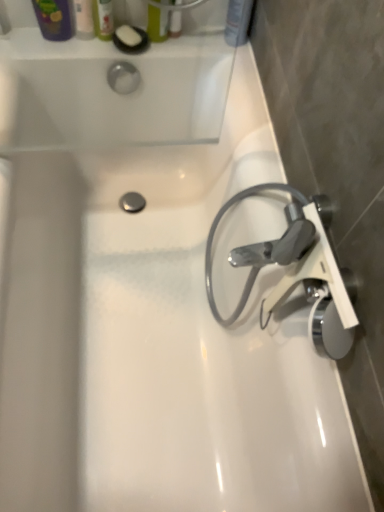
Measure the distance between white matte soap at upper left and camera.

white matte soap at upper left is 1.14 meters from camera.

This screenshot has width=384, height=512. What are the coordinates of `translucent plastic mouthwash at upper center` in the screenshot? It's located at (175, 20).

Locate an element on the screen. The width and height of the screenshot is (384, 512). translucent plastic soap at upper left, acting as the 3th toiletry starting from the right is located at coordinates (103, 19).

Where is `white matte soap at upper left`? white matte soap at upper left is located at coordinates (128, 35).

Is translucent plastic soap at upper left, acting as the 3th toiletry starting from the right, to the right of matte plastic soap at upper left, which is the 1th toiletry from left to right, from the viewer's perspective?

Indeed, translucent plastic soap at upper left, acting as the 3th toiletry starting from the right, is positioned on the right side of matte plastic soap at upper left, which is the 1th toiletry from left to right.

How distant is translucent plastic soap at upper left, positioned as the 2th toiletry in left-to-right order, from matte plastic soap at upper left, arranged as the fourth toiletry when viewed from the right?

translucent plastic soap at upper left, positioned as the 2th toiletry in left-to-right order, is 1.38 inches from matte plastic soap at upper left, arranged as the fourth toiletry when viewed from the right.

Is translucent plastic soap at upper left, positioned as the 2th toiletry in left-to-right order, further to camera compared to matte plastic soap at upper left, arranged as the fourth toiletry when viewed from the right?

No, it is not.

How different are the orientations of translucent plastic soap at upper left, positioned as the 2th toiletry in left-to-right order, and matte plastic soap at upper left, which is the 1th toiletry from left to right, in degrees?

There is a 0.00112-degree angle between the facing directions of translucent plastic soap at upper left, positioned as the 2th toiletry in left-to-right order, and matte plastic soap at upper left, which is the 1th toiletry from left to right.

In the image, is matte plastic soap at upper left, arranged as the fourth toiletry when viewed from the right, on the left side or the right side of matte green bottle at upper center, which is the 3th toiletry in left-to-right order?

From the image, it's evident that matte plastic soap at upper left, arranged as the fourth toiletry when viewed from the right, is to the left of matte green bottle at upper center, which is the 3th toiletry in left-to-right order.

Considering the sizes of objects matte plastic soap at upper left, arranged as the fourth toiletry when viewed from the right, and matte green bottle at upper center, which is the 3th toiletry in left-to-right order, in the image provided, who is shorter, matte plastic soap at upper left, arranged as the fourth toiletry when viewed from the right, or matte green bottle at upper center, which is the 3th toiletry in left-to-right order,?

With less height is matte plastic soap at upper left, arranged as the fourth toiletry when viewed from the right.

At what (x,y) coordinates should I click in order to perform the action: click on the 2nd toiletry behind the matte green bottle at upper center, the second toiletry in the right-to-left sequence, counting from the anchor's position. Please return your answer as a coordinate pair (x, y). This screenshot has height=512, width=384. Looking at the image, I should click on (84, 19).

Considering the relative positions of matte plastic soap at upper left, which is the 1th toiletry from left to right, and matte green bottle at upper center, the second toiletry in the right-to-left sequence, in the image provided, is matte plastic soap at upper left, which is the 1th toiletry from left to right, in front of matte green bottle at upper center, the second toiletry in the right-to-left sequence,?

No, matte plastic soap at upper left, which is the 1th toiletry from left to right, is further to the viewer.

Can you confirm if white matte soap at upper left is shorter than translucent plastic soap at upper left, positioned as the 2th toiletry in left-to-right order?

Yes.

Based on the photo, considering the relative sizes of white matte soap at upper left and translucent plastic soap at upper left, positioned as the 2th toiletry in left-to-right order, in the image provided, is white matte soap at upper left wider than translucent plastic soap at upper left, positioned as the 2th toiletry in left-to-right order,?

Yes, white matte soap at upper left is wider than translucent plastic soap at upper left, positioned as the 2th toiletry in left-to-right order.

From the image's perspective, which is above, white matte soap at upper left or translucent plastic soap at upper left, positioned as the 2th toiletry in left-to-right order?

translucent plastic soap at upper left, positioned as the 2th toiletry in left-to-right order.

From the image's perspective, between white matte soap at upper left and translucent plastic mouthwash at upper center, which one is located above?

translucent plastic mouthwash at upper center, from the image's perspective.

How far apart are white matte soap at upper left and translucent plastic mouthwash at upper center?

They are 4.38 inches apart.

Is point (123, 28) positioned after point (179, 33)?

No, it is not.

Considering their positions, is matte green bottle at upper center, which is the 3th toiletry in left-to-right order, located in front of or behind satin chrome faucet at right?

Clearly, matte green bottle at upper center, which is the 3th toiletry in left-to-right order, is behind satin chrome faucet at right.

From a real-world perspective, is matte green bottle at upper center, the second toiletry in the right-to-left sequence, positioned over satin chrome faucet at right based on gravity?

Yes, from a real-world perspective, matte green bottle at upper center, the second toiletry in the right-to-left sequence, is on top of satin chrome faucet at right.

Considering the positions of objects matte green bottle at upper center, the second toiletry in the right-to-left sequence, and satin chrome faucet at right in the image provided, who is more to the left, matte green bottle at upper center, the second toiletry in the right-to-left sequence, or satin chrome faucet at right?

Positioned to the left is matte green bottle at upper center, the second toiletry in the right-to-left sequence.

Is matte green bottle at upper center, the second toiletry in the right-to-left sequence, bigger than satin chrome faucet at right?

No.

Considering the positions of objects satin chrome faucet at right and translucent plastic soap at upper left, positioned as the 2th toiletry in left-to-right order, in the image provided, who is more to the left, satin chrome faucet at right or translucent plastic soap at upper left, positioned as the 2th toiletry in left-to-right order,?

Positioned to the left is translucent plastic soap at upper left, positioned as the 2th toiletry in left-to-right order.

From the image's perspective, is satin chrome faucet at right beneath translucent plastic soap at upper left, positioned as the 2th toiletry in left-to-right order?

Yes, from the image's perspective, satin chrome faucet at right is beneath translucent plastic soap at upper left, positioned as the 2th toiletry in left-to-right order.

Locate an element on the screen. This screenshot has height=512, width=384. tap located above the translucent plastic soap at upper left, acting as the 3th toiletry starting from the right (from a real-world perspective) is located at coordinates (296, 270).

Who is smaller, matte green bottle at upper center, the second toiletry in the right-to-left sequence, or white matte soap at upper left?

white matte soap at upper left.

Looking at this image, from a real-world perspective, is matte green bottle at upper center, the second toiletry in the right-to-left sequence, over white matte soap at upper left?

Yes, from a real-world perspective, matte green bottle at upper center, the second toiletry in the right-to-left sequence, is on top of white matte soap at upper left.

Is matte green bottle at upper center, which is the 3th toiletry in left-to-right order, to the right of white matte soap at upper left from the viewer's perspective?

Yes.

The image size is (384, 512). Find the location of `toiletry below the translucent plastic soap at upper left, acting as the 3th toiletry starting from the right (from a real-world perspective)`. toiletry below the translucent plastic soap at upper left, acting as the 3th toiletry starting from the right (from a real-world perspective) is located at coordinates (84, 19).

Image resolution: width=384 pixels, height=512 pixels. Identify the location of the 2nd toiletry below the matte green bottle at upper center, the second toiletry in the right-to-left sequence (from the image's perspective). (84, 19).

From the image, which object appears to be farther from translucent plastic soap at upper left, acting as the 3th toiletry starting from the right, matte green bottle at upper center, the second toiletry in the right-to-left sequence, or matte plastic shampoo bottle at upper right, which ranks as the 4th toiletry in left-to-right order?

Among the two, matte plastic shampoo bottle at upper right, which ranks as the 4th toiletry in left-to-right order, is located further to translucent plastic soap at upper left, acting as the 3th toiletry starting from the right.

Looking at the image, which one is located further to white matte soap at upper left, translucent plastic mouthwash at upper center or matte plastic shampoo bottle at upper right, which ranks as the 4th toiletry in left-to-right order?

Among the two, matte plastic shampoo bottle at upper right, which ranks as the 4th toiletry in left-to-right order, is located further to white matte soap at upper left.

Estimate the real-world distances between objects in this image. Which object is further from translucent plastic soap at upper left, acting as the 3th toiletry starting from the right, matte plastic shampoo bottle at upper right, marked as the 1th toiletry in a right-to-left arrangement, or white matte soap at upper left?

matte plastic shampoo bottle at upper right, marked as the 1th toiletry in a right-to-left arrangement, is further to translucent plastic soap at upper left, acting as the 3th toiletry starting from the right.

When comparing their distances from white matte soap at upper left, does matte green bottle at upper center, which is the 3th toiletry in left-to-right order, or matte plastic shampoo bottle at upper right, which ranks as the 4th toiletry in left-to-right order, seem further?

matte plastic shampoo bottle at upper right, which ranks as the 4th toiletry in left-to-right order, is further to white matte soap at upper left.

Based on their spatial positions, is translucent plastic soap at upper left, positioned as the 2th toiletry in left-to-right order, or matte plastic soap at upper left, arranged as the fourth toiletry when viewed from the right, further from white matte soap at upper left?

Among the two, matte plastic soap at upper left, arranged as the fourth toiletry when viewed from the right, is located further to white matte soap at upper left.

When comparing their distances from satin chrome faucet at right, does matte plastic shampoo bottle at upper right, marked as the 1th toiletry in a right-to-left arrangement, or translucent plastic soap at upper left, acting as the 3th toiletry starting from the right, seem further?

translucent plastic soap at upper left, acting as the 3th toiletry starting from the right, is positioned further to the anchor satin chrome faucet at right.

Considering their positions, is translucent plastic soap at upper left, acting as the 3th toiletry starting from the right, positioned further to white matte soap at upper left than satin chrome faucet at right?

satin chrome faucet at right lies further to white matte soap at upper left than the other object.

Estimate the real-world distances between objects in this image. Which object is further from white matte soap at upper left, satin chrome faucet at right or translucent plastic soap at upper left, acting as the 3th toiletry starting from the right?

The object further to white matte soap at upper left is satin chrome faucet at right.

At what (x,y) coordinates should I click in order to perform the action: click on soap between translucent plastic mouthwash at upper center and satin chrome faucet at right vertically. Please return your answer as a coordinate pair (x, y). Looking at the image, I should click on (128, 35).

You are a GUI agent. You are given a task and a screenshot of the screen. Output one action in this format:
    pyautogui.click(x=<x>, y=<y>)
    Task: Click on the mouthwash between translucent plastic soap at upper left, positioned as the 2th toiletry in left-to-right order, and matte plastic shampoo bottle at upper right, marked as the 1th toiletry in a right-to-left arrangement, in the horizontal direction
    This screenshot has width=384, height=512.
    Given the screenshot: What is the action you would take?
    pyautogui.click(x=175, y=20)

The width and height of the screenshot is (384, 512). I want to click on soap that lies between matte plastic soap at upper left, which is the 1th toiletry from left to right, and satin chrome faucet at right from top to bottom, so click(128, 35).

Image resolution: width=384 pixels, height=512 pixels. What are the coordinates of `soap between matte plastic soap at upper left, which is the 1th toiletry from left to right, and matte plastic shampoo bottle at upper right, marked as the 1th toiletry in a right-to-left arrangement` in the screenshot? It's located at (128, 35).